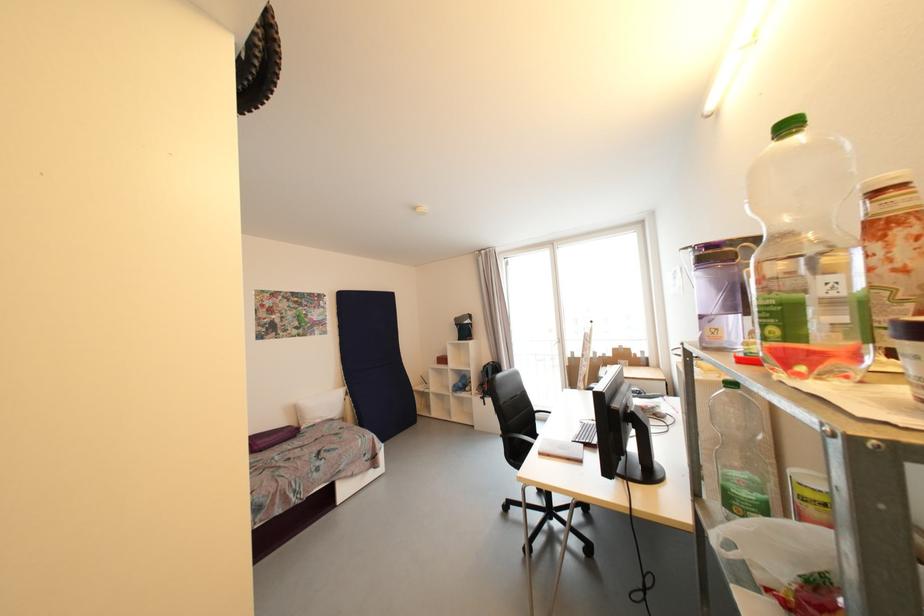
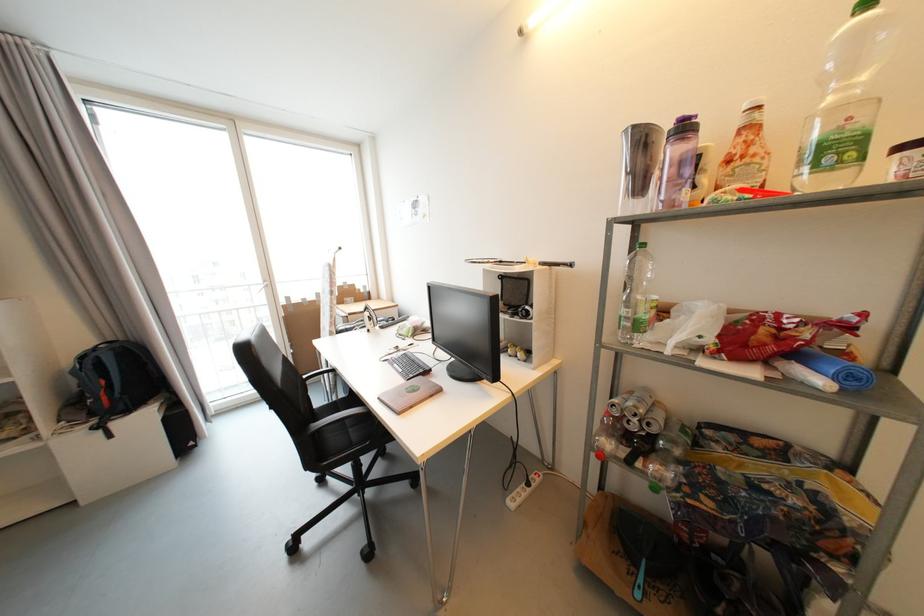
The point at (488, 400) is marked in the first image. Where is the corresponding point in the second image?

(104, 429)